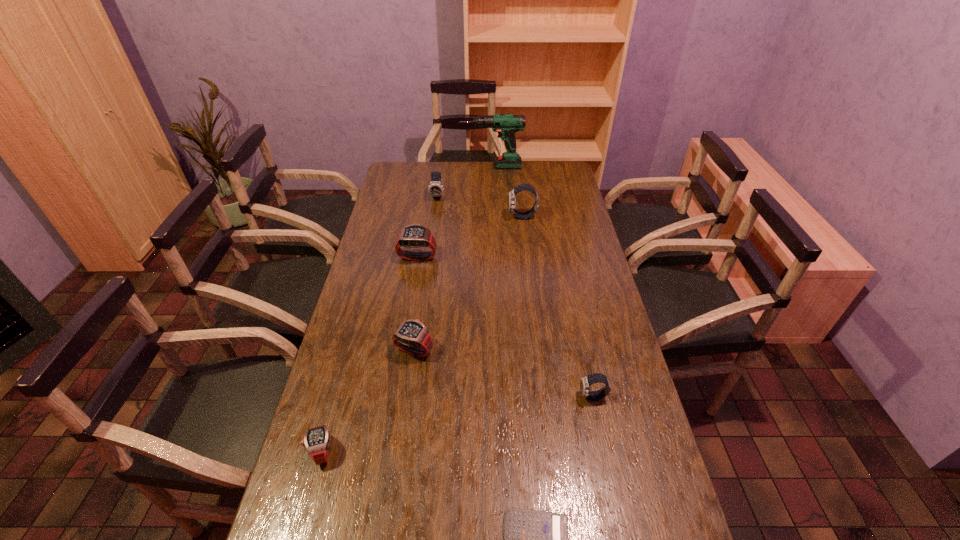
Find the location of a particular element. Image resolution: width=960 pixels, height=540 pixels. green drill is located at coordinates (506, 125).

Identify the location of the farthest object. The image size is (960, 540). (506, 125).

I want to click on the second watch from right to left, so click(x=522, y=187).

Find the location of a particular element. the second farthest watch is located at coordinates (522, 187).

The height and width of the screenshot is (540, 960). Identify the location of the fifth nearest object. (415, 235).

Find the location of a particular element. The width and height of the screenshot is (960, 540). the biggest red watch is located at coordinates (415, 235).

This screenshot has width=960, height=540. In order to click on the second farthest object in this screenshot , I will do `click(435, 188)`.

Where is `the second smallest dark watch`? The height and width of the screenshot is (540, 960). the second smallest dark watch is located at coordinates (435, 188).

The image size is (960, 540). I want to click on the second smallest red watch, so [x=412, y=336].

Locate an element on the screen. the fifth farthest object is located at coordinates (412, 336).